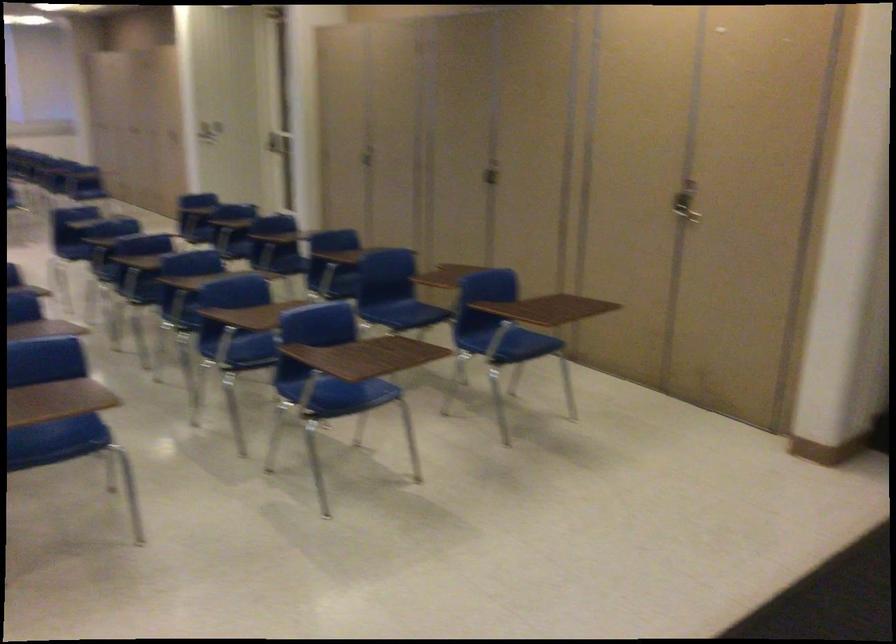
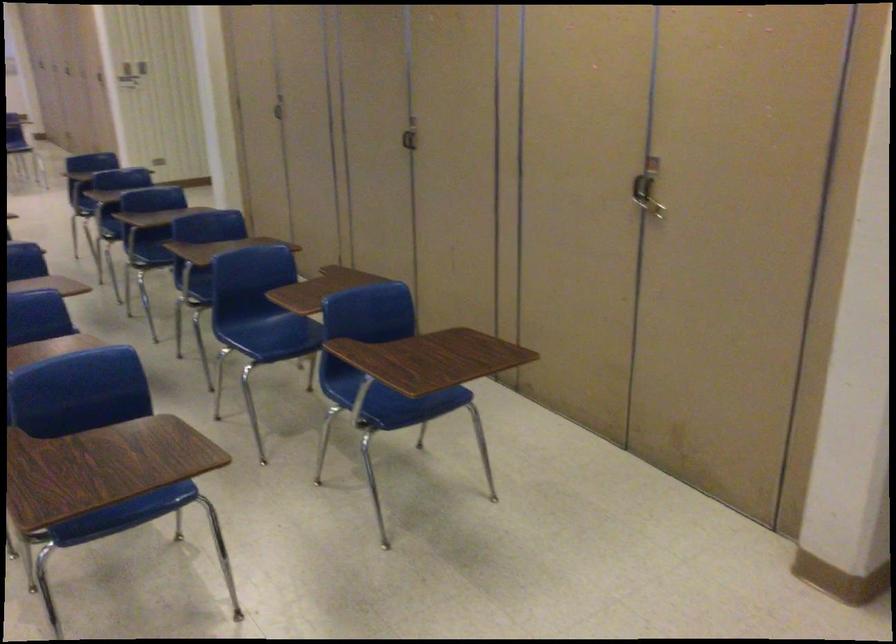
In the second image, find the point that corresponds to [397,306] in the first image.

(272, 328)